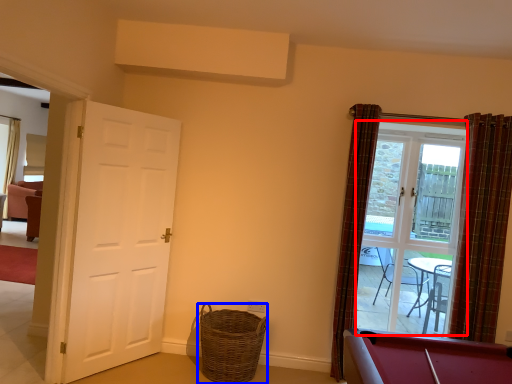
Question: Which object is further to the camera taking this photo, glass door (highlighted by a red box) or basket (highlighted by a blue box)?

Choices:
 (A) glass door
 (B) basket

Answer: (A)